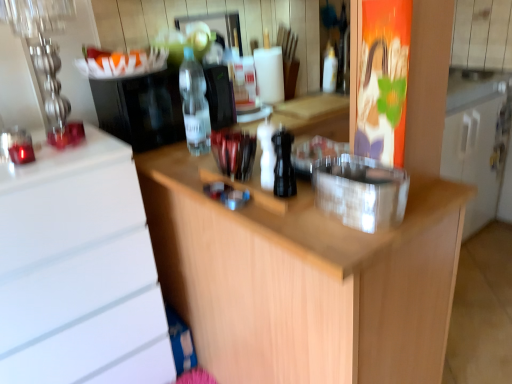
Question: Is transparent plastic container at center, which is the second appliance in back-to-front order, far away from transparent plastic bottle at upper center, which is the 1th bottle in top-to-bottom order?

Choices:
 (A) yes
 (B) no

Answer: (A)

Question: Is transparent plastic container at center, which is the second appliance in back-to-front order, bigger than transparent plastic bottle at upper center, which is the 1th bottle in top-to-bottom order?

Choices:
 (A) yes
 (B) no

Answer: (A)

Question: Does transparent plastic container at center, which appears as the first appliance when viewed from the right, turn towards transparent plastic bottle at upper center, arranged as the third bottle when viewed from the front?

Choices:
 (A) yes
 (B) no

Answer: (B)

Question: From a real-world perspective, does transparent plastic container at center, the second appliance from the left, stand above transparent plastic bottle at upper center, arranged as the third bottle when viewed from the front?

Choices:
 (A) no
 (B) yes

Answer: (A)

Question: Is transparent plastic container at center, which is counted as the first appliance, starting from the bottom, looking in the opposite direction of transparent plastic bottle at upper center, arranged as the third bottle when viewed from the front?

Choices:
 (A) no
 (B) yes

Answer: (A)

Question: From the image's perspective, is wooden at center above or below transparent plastic bottle at upper center, which is the 1th bottle in top-to-bottom order?

Choices:
 (A) below
 (B) above

Answer: (A)

Question: In terms of width, does wooden at center look wider or thinner when compared to transparent plastic bottle at upper center, the third bottle ordered from the bottom?

Choices:
 (A) wide
 (B) thin

Answer: (A)

Question: From a real-world perspective, is wooden at center positioned above or below transparent plastic bottle at upper center, arranged as the first bottle when viewed from the right?

Choices:
 (A) above
 (B) below

Answer: (B)

Question: Is point (251, 347) positioned closer to the camera than point (325, 56)?

Choices:
 (A) closer
 (B) farther

Answer: (A)

Question: Considering the positions of black matte pepper grinder at center, which is counted as the 3th bottle, starting from the top, and transparent plastic bottle at upper center, the third bottle ordered from the bottom, in the image, is black matte pepper grinder at center, which is counted as the 3th bottle, starting from the top, wider or thinner than transparent plastic bottle at upper center, the third bottle ordered from the bottom,?

Choices:
 (A) wide
 (B) thin

Answer: (A)

Question: From a real-world perspective, relative to transparent plastic bottle at upper center, which appears as the 1th bottle when viewed from the back, is black matte pepper grinder at center, which is counted as the 3th bottle, starting from the top, vertically above or below?

Choices:
 (A) below
 (B) above

Answer: (A)

Question: Looking at the image, does black matte pepper grinder at center, the second bottle viewed from the right, seem bigger or smaller compared to transparent plastic bottle at upper center, which appears as the 1th bottle when viewed from the back?

Choices:
 (A) big
 (B) small

Answer: (B)

Question: In the image, is black matte pepper grinder at center, the second bottle viewed from the right, positioned in front of or behind transparent plastic bottle at upper center, arranged as the third bottle when viewed from the front?

Choices:
 (A) front
 (B) behind

Answer: (A)

Question: Considering the positions of wooden at center and white glossy cabinet at left in the image, is wooden at center wider or thinner than white glossy cabinet at left?

Choices:
 (A) thin
 (B) wide

Answer: (B)

Question: Is wooden at center taller or shorter than white glossy cabinet at left?

Choices:
 (A) tall
 (B) short

Answer: (B)